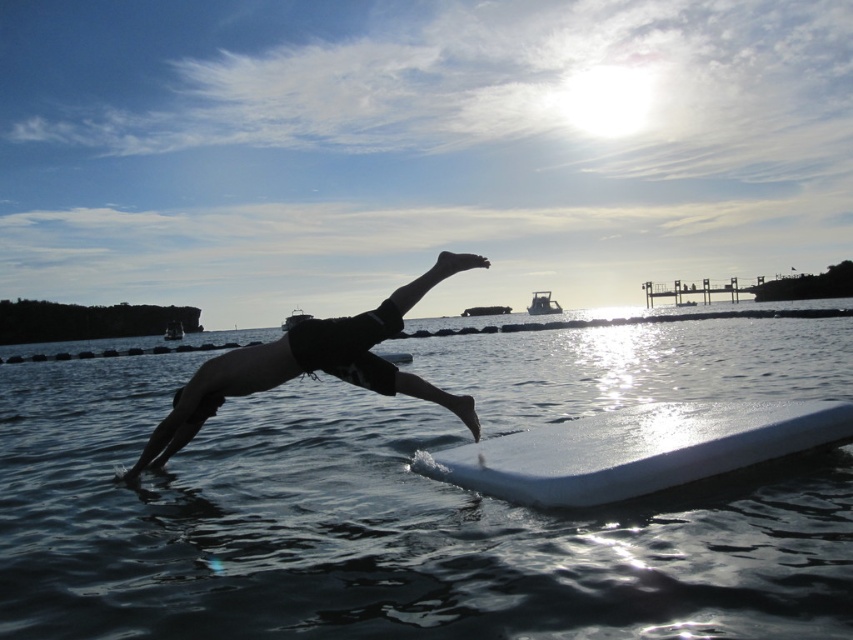
Who is more distant from viewer, (312, 483) or (424, 288)?

Point (312, 483)

Can you confirm if transparent water at center is positioned below black matte shorts at center?

Correct, transparent water at center is located below black matte shorts at center.

Between point (763, 372) and point (415, 288), which one is positioned behind?

Positioned behind is point (763, 372).

You are a GUI agent. You are given a task and a screenshot of the screen. Output one action in this format:
    pyautogui.click(x=<x>, y=<y>)
    Task: Click on the transparent water at center
    This screenshot has width=853, height=640.
    Given the screenshot: What is the action you would take?
    pyautogui.click(x=370, y=529)

Find the location of a particular element. This screenshot has width=853, height=640. white foam surfboard at center is located at coordinates (635, 451).

The image size is (853, 640). I want to click on white foam surfboard at center, so click(x=635, y=451).

Between transparent water at center and white foam surfboard at center, which one appears on the right side from the viewer's perspective?

From the viewer's perspective, white foam surfboard at center appears more on the right side.

Does transparent water at center have a greater width compared to white foam surfboard at center?

Yes, transparent water at center is wider than white foam surfboard at center.

Does point (781, 390) lie behind point (497, 484)?

Yes, it is.

This screenshot has width=853, height=640. What are the coordinates of `transparent water at center` in the screenshot? It's located at (370, 529).